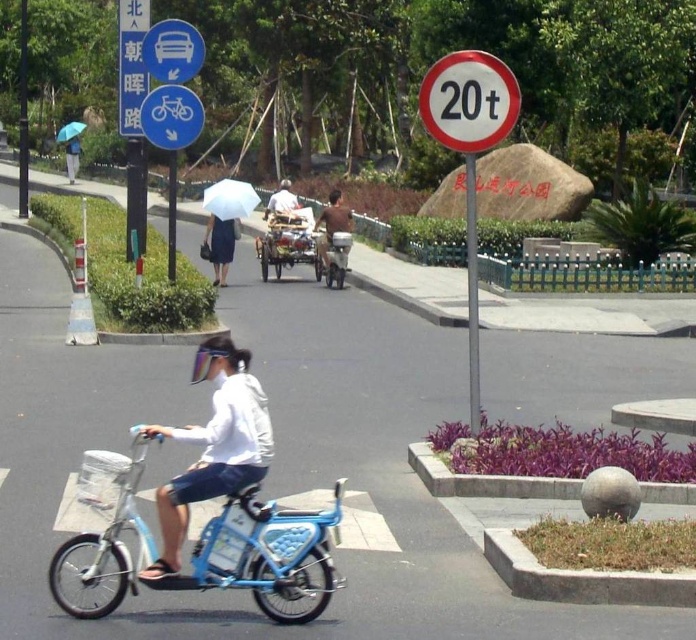
You are standing at the point marked by the coordinates point (173, 51). What object is located at that position?

The point (173, 51) indicates a brushed metal car at upper center.

You are a photographer standing at the edge of the park. You want to take a photo of the white matte jacket at center. Where should you aim your camera to capture it in the frame?

You should aim your camera at the point with coordinates (213,445) to capture the white matte jacket at center in the frame.

You are standing at point (158, 129) and want to walk to point (248, 404). Are you facing the right direction to reach there without turning?

Yes, because point (248, 404) is in front of point (158, 129), so you are facing the correct direction to reach it without needing to turn.